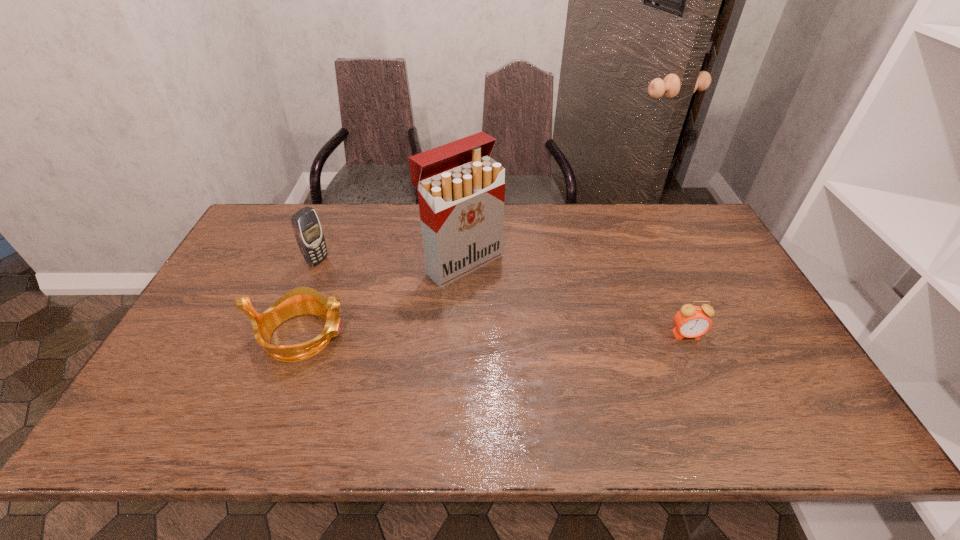
Identify which object is the third nearest to the alarm clock. Please provide its 2D coordinates. Your answer should be formatted as a tuple, i.e. [(x, y)], where the tuple contains the x and y coordinates of a point satisfying the conditions above.

[(307, 229)]

Identify which object is the third nearest to the cigarette case. Please provide its 2D coordinates. Your answer should be formatted as a tuple, i.e. [(x, y)], where the tuple contains the x and y coordinates of a point satisfying the conditions above.

[(691, 321)]